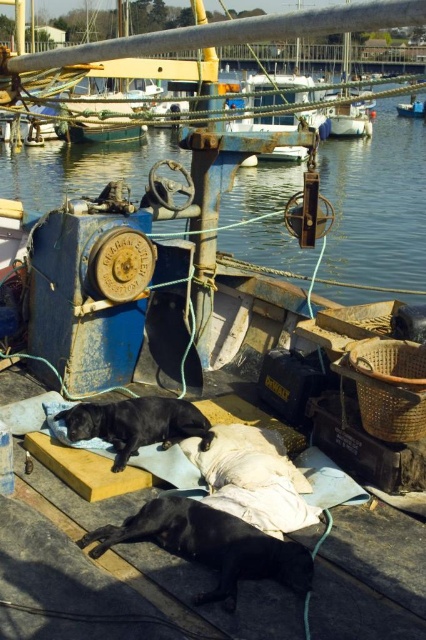
You are standing at the point closest to the boat deck. There are two points marked on the deck. One is labeled as point (356, 291) and the other is point (183, 538). Which point is farther away from you?

Point (356, 291) is behind point (183, 538), so it is farther away from you.

You are standing on the dock looking at the blue metallic water at center and the black matte dog at center. Which object is closer to you?

The black matte dog at center is closer to you than the blue metallic water at center because the blue metallic water is further away.

Looking at this image, you are standing on the deck of the fishing boat and want to move from the point at coordinates (92, 166) to the point at (72, 428). Which direction should you move to get closer to the camera?

To move closer to the camera from point (92, 166) to point (72, 428), you should move towards the point at (72, 428) since it is closer to the camera than the other point.